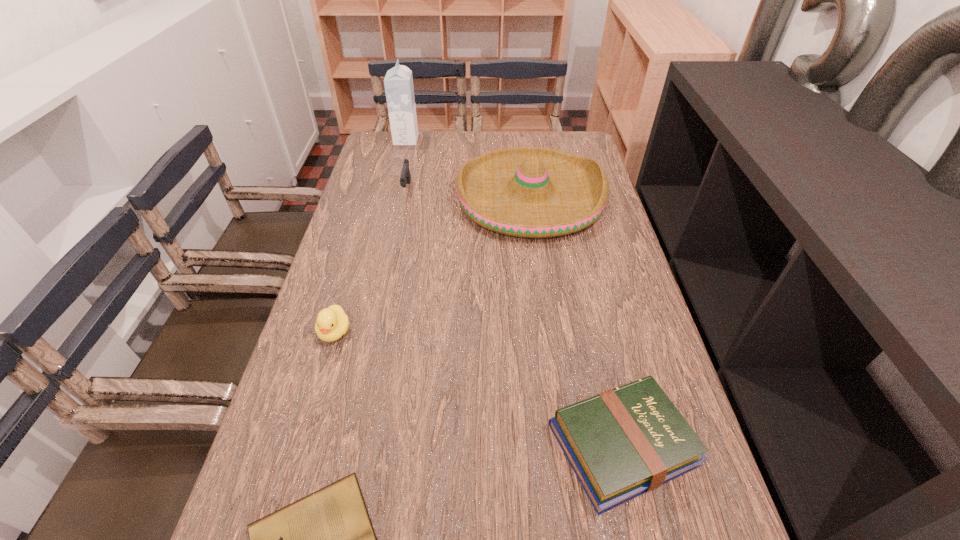
This screenshot has height=540, width=960. Find the location of `vacant point located 0.370m on the beak of the fourth farthest object`. vacant point located 0.370m on the beak of the fourth farthest object is located at coordinates (276, 531).

The image size is (960, 540). I want to click on free space located 0.080m on the back of the fifth tallest object, so click(602, 355).

Image resolution: width=960 pixels, height=540 pixels. Find the location of `carton located in the far edge section of the desktop`. carton located in the far edge section of the desktop is located at coordinates (398, 82).

You are a GUI agent. You are given a task and a screenshot of the screen. Output one action in this format:
    pyautogui.click(x=<x>, y=<y>)
    Task: Click on the sombrero located at the far edge
    
    Given the screenshot: What is the action you would take?
    pyautogui.click(x=531, y=192)

At what (x,y) coordinates should I click in order to perform the action: click on carton located at the left edge. Please return your answer as a coordinate pair (x, y). This screenshot has height=540, width=960. Looking at the image, I should click on (398, 82).

Where is `pistol present at the left edge`? The height and width of the screenshot is (540, 960). pistol present at the left edge is located at coordinates (405, 178).

Find the location of a particular element. Image resolution: width=960 pixels, height=540 pixels. duckling that is at the left edge is located at coordinates (332, 323).

I want to click on sombrero that is at the right edge, so (531, 192).

Image resolution: width=960 pixels, height=540 pixels. Find the location of `book at the right edge`. book at the right edge is located at coordinates (621, 443).

Identify the location of object situated at the far left corner. (398, 82).